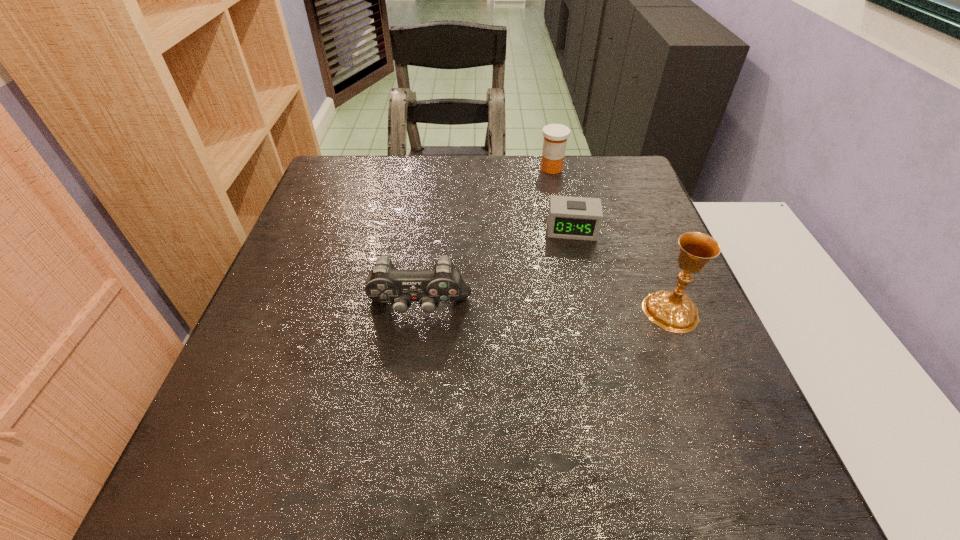
The height and width of the screenshot is (540, 960). What are the coordinates of `vacant space at the far left corner of the desktop` in the screenshot? It's located at (366, 158).

Identify the location of vacant space at the near left corner of the desktop. This screenshot has width=960, height=540. (251, 408).

Identify the location of vacant space at the near right corner of the desktop. (670, 406).

The width and height of the screenshot is (960, 540). What are the coordinates of `empty space that is in between the leftmost object and the alarm clock` in the screenshot? It's located at (495, 269).

Locate an element on the screen. vacant area that lies between the farthest object and the control is located at coordinates (485, 239).

Locate an element on the screen. This screenshot has width=960, height=540. free spot between the chalice and the farthest object is located at coordinates (612, 240).

Locate an element on the screen. This screenshot has width=960, height=540. free space between the control and the farthest object is located at coordinates (485, 239).

Locate an element on the screen. unoccupied area between the farthest object and the chalice is located at coordinates (612, 240).

Identify the location of vacant area that lies between the control and the medicine. (485, 239).

Locate an element on the screen. free space between the chalice and the shortest object is located at coordinates (621, 271).